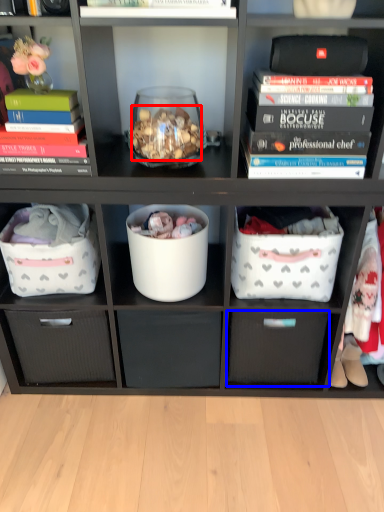
Question: Which object is further to the camera taking this photo, stuff (highlighted by a red box) or drawer (highlighted by a blue box)?

Choices:
 (A) stuff
 (B) drawer

Answer: (B)